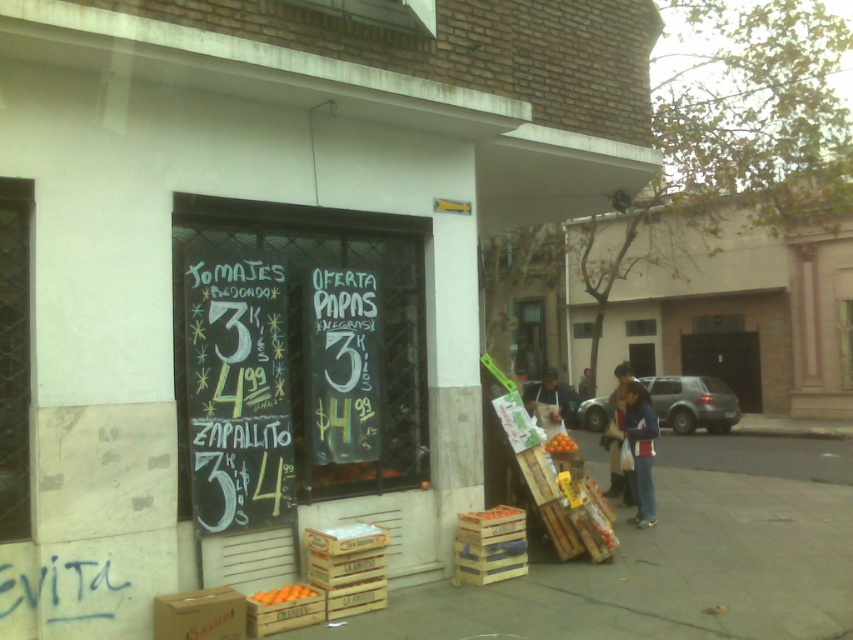
Question: Can you confirm if orange wooden crate at lower center is bigger than orangewooden crate at lower center?

Choices:
 (A) yes
 (B) no

Answer: (A)

Question: Which object is farther from the camera taking this photo?

Choices:
 (A) orange wooden crate at lower center
 (B) orange matte at center
 (C) blue denim jacket at lower right
 (D) white fabric bag at center

Answer: (D)

Question: Can you confirm if blue denim jacket at lower right is positioned to the left of dark blue jeans at lower right?

Choices:
 (A) yes
 (B) no

Answer: (A)

Question: Where is white fabric bag at center located in relation to dark blue jeans at lower right in the image?

Choices:
 (A) left
 (B) right

Answer: (A)

Question: Which point is farther to the camera?

Choices:
 (A) (51, 595)
 (B) (550, 445)
 (C) (584, 390)
 (D) (286, 592)

Answer: (C)

Question: Which point is farther from the camera taking this photo?

Choices:
 (A) click(x=282, y=500)
 (B) click(x=83, y=602)

Answer: (A)